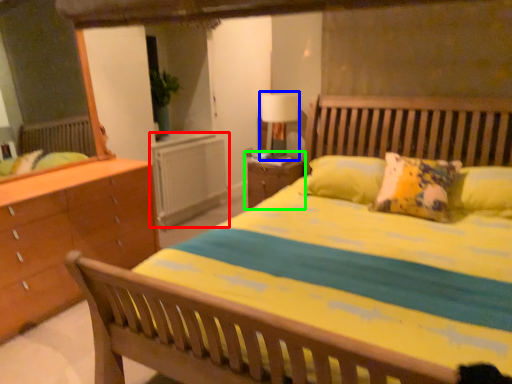
Question: Based on their relative distances, which object is farther from radiator (highlighted by a red box)? Choose from table lamp (highlighted by a blue box) and nightstand (highlighted by a green box).

Choices:
 (A) table lamp
 (B) nightstand

Answer: (A)